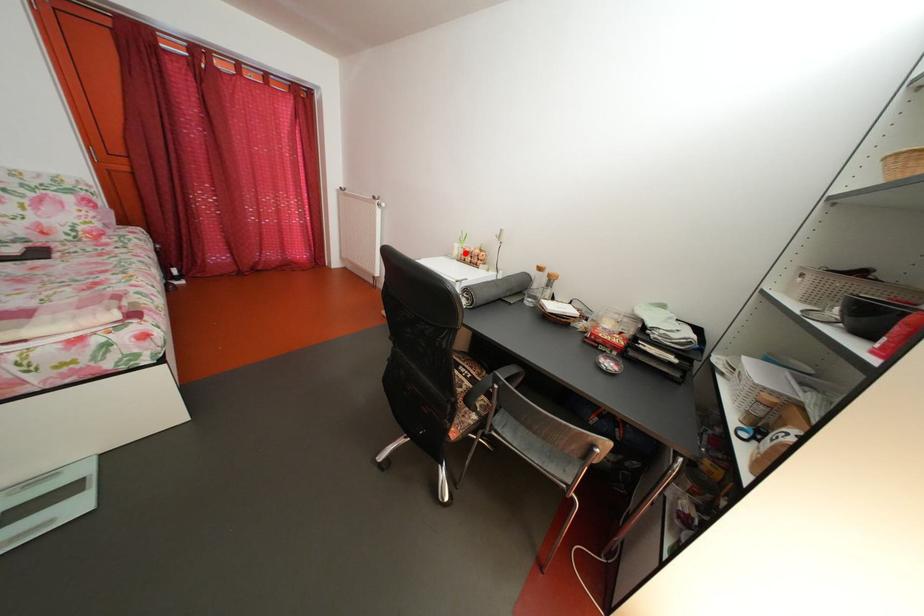
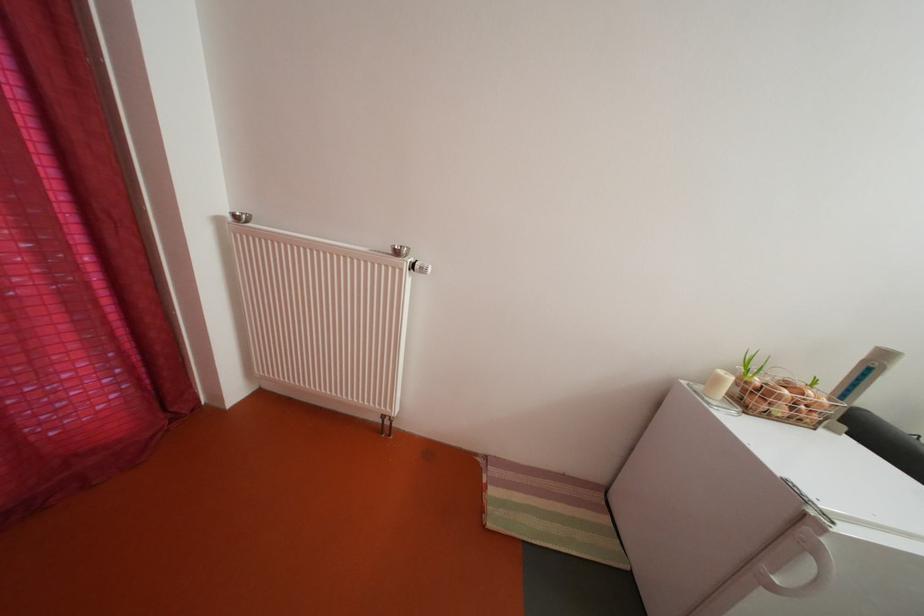
Find the pixel in the second image that matches the highlighted location in the first image.

(728, 386)